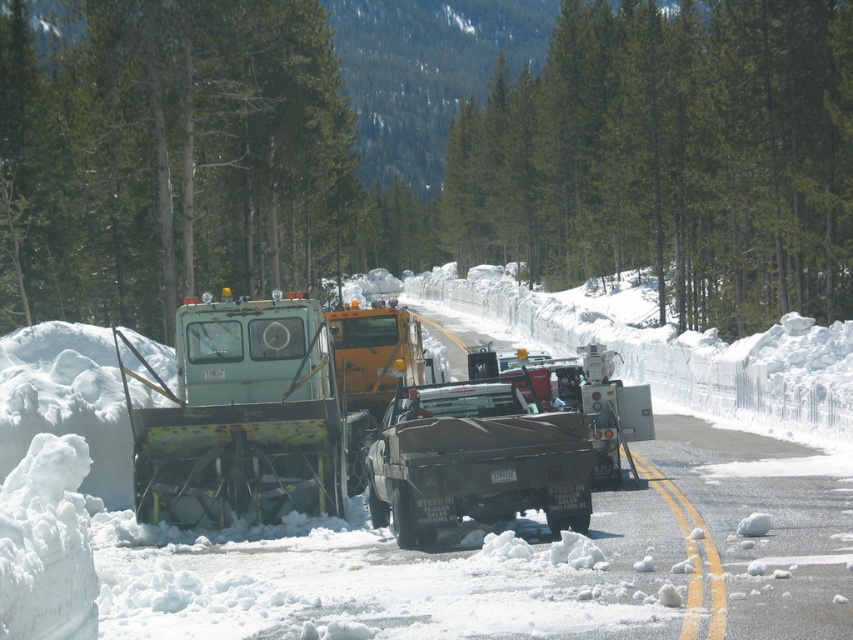
Question: Considering the real-world distances, which object is closest to the rusty metal snowplow at left?

Choices:
 (A) white fluffy snow at center
 (B) matte black trailer truck at center
 (C) green matte snowplow at center

Answer: (C)

Question: Which of the following is the farthest from the observer?

Choices:
 (A) (224, 188)
 (B) (273, 449)
 (C) (506, 433)

Answer: (A)

Question: Is green matte tree at center to the left of white fluffy snow at center from the viewer's perspective?

Choices:
 (A) no
 (B) yes

Answer: (B)

Question: Does white fluffy snow at center appear over rusty metal snowplow at left?

Choices:
 (A) yes
 (B) no

Answer: (A)

Question: Which object appears closest to the camera in this image?

Choices:
 (A) matte black trailer truck at center
 (B) green matte snowplow at center
 (C) green matte tree at center

Answer: (A)

Question: Is green matte tree at center thinner than white fluffy snow at center?

Choices:
 (A) no
 (B) yes

Answer: (A)